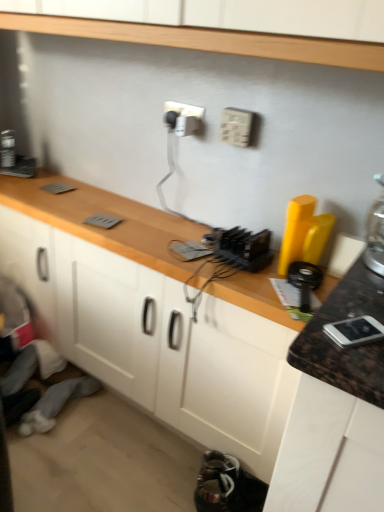
This screenshot has height=512, width=384. What do you see at coordinates (29, 261) in the screenshot? I see `matte gray cabinet at lower left` at bounding box center [29, 261].

Describe the element at coordinates (183, 117) in the screenshot. I see `white plastic electric outlet at upper center, the second electric outlet from the front` at that location.

What do you see at coordinates (104, 212) in the screenshot? I see `wooden at center` at bounding box center [104, 212].

Where is `silver metallic phone at right`? Image resolution: width=384 pixels, height=512 pixels. silver metallic phone at right is located at coordinates [354, 331].

Can you tell me how much silver metallic phone at right and matte gray cabinet at lower left differ in facing direction?

120 degrees separate the facing orientations of silver metallic phone at right and matte gray cabinet at lower left.

Where is `cabinetry on the left of silver metallic phone at right`? cabinetry on the left of silver metallic phone at right is located at coordinates click(29, 261).

Does silver metallic phone at right have a greater width compared to matte gray cabinet at lower left?

No, silver metallic phone at right is not wider than matte gray cabinet at lower left.

In the scene shown: Who is taller, multicolored fabric shoes at lower center or matte gray cabinet at lower left?

matte gray cabinet at lower left.

Would you say matte gray cabinet at lower left is part of multicolored fabric shoes at lower center's contents?

No, matte gray cabinet at lower left is not a part of multicolored fabric shoes at lower center.

Is multicolored fabric shoes at lower center wider or thinner than matte gray cabinet at lower left?

Considering their sizes, multicolored fabric shoes at lower center looks slimmer than matte gray cabinet at lower left.

Where is `countertop below the silver metallic phone at right (from the image's perspective)`? countertop below the silver metallic phone at right (from the image's perspective) is located at coordinates [104, 212].

From the image's perspective, between wooden at center and silver metallic phone at right, which one is located above?

silver metallic phone at right appears higher in the image.

Is wooden at center thinner than silver metallic phone at right?

Incorrect, the width of wooden at center is not less than that of silver metallic phone at right.

Considering the relative sizes of multicolored fabric shoes at lower center and white plastic electric outlet at upper center, the 1th electric outlet when ordered from left to right, in the image provided, is multicolored fabric shoes at lower center wider than white plastic electric outlet at upper center, the 1th electric outlet when ordered from left to right,?

Indeed, multicolored fabric shoes at lower center has a greater width compared to white plastic electric outlet at upper center, the 1th electric outlet when ordered from left to right.

Does multicolored fabric shoes at lower center come in front of white plastic electric outlet at upper center, the 1th electric outlet when ordered from left to right?

That is True.

From the image's perspective, relative to white plastic electric outlet at upper center, the second electric outlet from the front, is multicolored fabric shoes at lower center above or below?

Based on their image positions, multicolored fabric shoes at lower center is located beneath white plastic electric outlet at upper center, the second electric outlet from the front.

Considering the relative sizes of multicolored fabric shoes at lower center and white plastic electric outlet at upper center, the 1th electric outlet when ordered from left to right, in the image provided, is multicolored fabric shoes at lower center taller than white plastic electric outlet at upper center, the 1th electric outlet when ordered from left to right,?

Correct, multicolored fabric shoes at lower center is much taller as white plastic electric outlet at upper center, the 1th electric outlet when ordered from left to right.

From a real-world perspective, is white plastic electric outlet at upper center, which ranks as the second electric outlet in right-to-left order, positioned under wooden at center based on gravity?

No, from a real-world perspective, white plastic electric outlet at upper center, which ranks as the second electric outlet in right-to-left order, is not beneath wooden at center.

From the picture: Could you measure the distance between white plastic electric outlet at upper center, the 1th electric outlet viewed from the back, and wooden at center?

A distance of 18.71 inches exists between white plastic electric outlet at upper center, the 1th electric outlet viewed from the back, and wooden at center.

Looking at their sizes, would you say white plastic electric outlet at upper center, the 1th electric outlet viewed from the back, is wider or thinner than wooden at center?

Clearly, white plastic electric outlet at upper center, the 1th electric outlet viewed from the back, has less width compared to wooden at center.

Does wooden at center contain white plastic electric outlet at upper center, the 1th electric outlet when ordered from left to right?

Actually, white plastic electric outlet at upper center, the 1th electric outlet when ordered from left to right, is outside wooden at center.

From the image's perspective, which one is positioned higher, wooden at center or white plastic electric outlet at upper center, which ranks as the second electric outlet in right-to-left order?

From the image's view, white plastic electric outlet at upper center, which ranks as the second electric outlet in right-to-left order, is above.

Which object is further away from the camera, wooden at center or white plastic electric outlet at upper center, the 1th electric outlet when ordered from left to right?

white plastic electric outlet at upper center, the 1th electric outlet when ordered from left to right, is further from the camera.

Are wooden at center and white plastic electric outlet at upper center, which ranks as the second electric outlet in right-to-left order, located far from each other?

Actually, wooden at center and white plastic electric outlet at upper center, which ranks as the second electric outlet in right-to-left order, are a little close together.

Which object is positioned more to the left, silver metallic phone at right or white plastic electric outlet at upper center, which ranks as the second electric outlet in right-to-left order?

white plastic electric outlet at upper center, which ranks as the second electric outlet in right-to-left order, is more to the left.

Is silver metallic phone at right turned away from white plastic electric outlet at upper center, which ranks as the second electric outlet in right-to-left order?

No, silver metallic phone at right's orientation is not away from white plastic electric outlet at upper center, which ranks as the second electric outlet in right-to-left order.

Considering the sizes of objects silver metallic phone at right and white plastic electric outlet at upper center, the 1th electric outlet when ordered from left to right, in the image provided, who is smaller, silver metallic phone at right or white plastic electric outlet at upper center, the 1th electric outlet when ordered from left to right,?

white plastic electric outlet at upper center, the 1th electric outlet when ordered from left to right.

From the picture: Are silver metallic phone at right and white plastic electric outlet at upper center, the 1th electric outlet viewed from the back, far apart?

No.

The image size is (384, 512). I want to click on appliance in front of the matte gray cabinet at lower left, so pyautogui.click(x=354, y=331).

Locate an element on the screen. This screenshot has height=512, width=384. footwear beneath the matte gray cabinet at lower left (from a real-world perspective) is located at coordinates (227, 486).

Which object lies further to the anchor point white plastic electric outlet at upper center, the second electric outlet from the front, multicolored fabric shoes at lower center or silver metallic phone at right?

The object further to white plastic electric outlet at upper center, the second electric outlet from the front, is multicolored fabric shoes at lower center.

Based on the photo, considering their positions, is matte gray cabinet at lower left positioned further to white plastic electric outlet at upper center, which ranks as the second electric outlet in right-to-left order, than silver metallic phone at right?

Based on the image, silver metallic phone at right appears to be further to white plastic electric outlet at upper center, which ranks as the second electric outlet in right-to-left order.

Based on their spatial positions, is wooden at center or silver metallic phone at right closer to white plastic electric outlet at upper center, the 1th electric outlet when ordered from left to right?

wooden at center.

Considering their positions, is white plastic electric outlet at upper center, the 1th electric outlet viewed from the back, positioned further to matte gray cabinet at lower left than white plastic electric outlet at upper center, the second electric outlet from the left?

Among the two, white plastic electric outlet at upper center, the second electric outlet from the left, is located further to matte gray cabinet at lower left.

From the image, which object appears to be nearer to white plastic electric outlet at upper center, the second electric outlet from the front, matte gray cabinet at lower left or wooden at center?

wooden at center lies closer to white plastic electric outlet at upper center, the second electric outlet from the front, than the other object.

When comparing their distances from white plastic electric outlet at upper center, the second electric outlet from the left, does silver metallic phone at right or wooden at center seem further?

silver metallic phone at right is positioned further to the anchor white plastic electric outlet at upper center, the second electric outlet from the left.

From the image, which object appears to be farther from matte gray cabinet at lower left, silver metallic phone at right or wooden at center?

The object further to matte gray cabinet at lower left is silver metallic phone at right.

Looking at the image, which one is located closer to silver metallic phone at right, multicolored fabric shoes at lower center or matte gray cabinet at lower left?

multicolored fabric shoes at lower center is closer to silver metallic phone at right.

Identify the location of footwear between matte gray cabinet at lower left and silver metallic phone at right in the horizontal direction. This screenshot has width=384, height=512. coord(227,486).

This screenshot has height=512, width=384. In order to click on appliance between white plastic electric outlet at upper center, the 1th electric outlet viewed from the back, and multicolored fabric shoes at lower center from top to bottom in this screenshot , I will do `click(354, 331)`.

Identify the location of appliance between white plastic electric outlet at upper center, which ranks as the second electric outlet in right-to-left order, and wooden at center from top to bottom. This screenshot has height=512, width=384. (354, 331).

Find the location of a particular element. countertop between silver metallic phone at right and multicolored fabric shoes at lower center in the up-down direction is located at coordinates (104, 212).